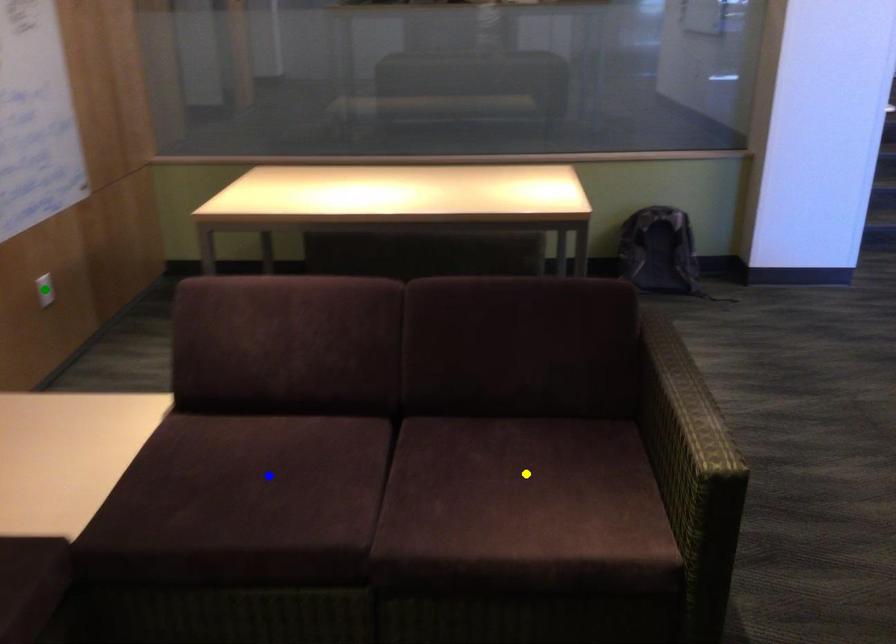
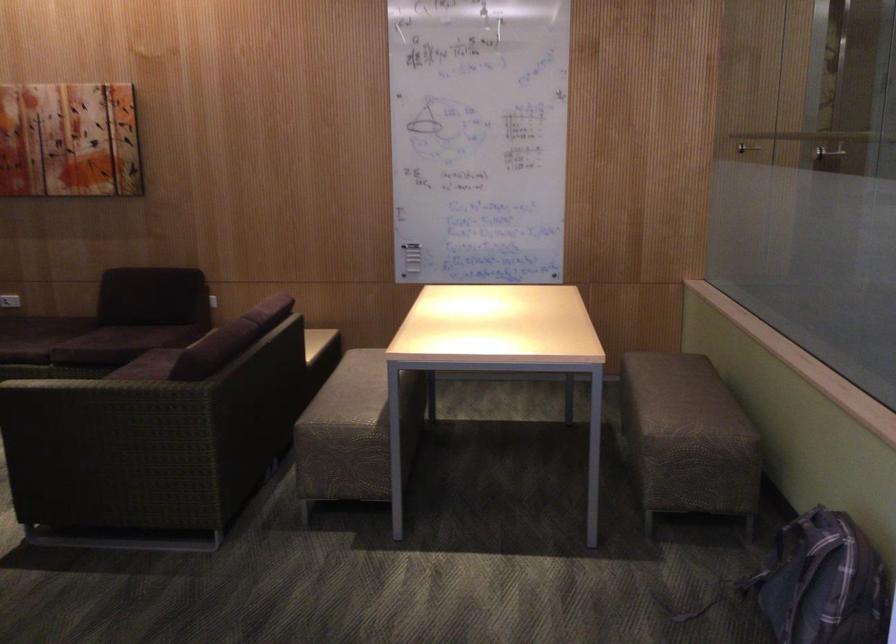
I am providing you with two images of the same scene from different viewpoints. Three points are marked in image1. Which point corresponds to a part or object that is occluded in image2?In image1, three points are marked. Which of them correspond to a part or object that is occluded in image2?Among the three points shown in image1, which one corresponds to a part or object that is no longer visible due to occlusion in image2?

yellow point, blue point, green point